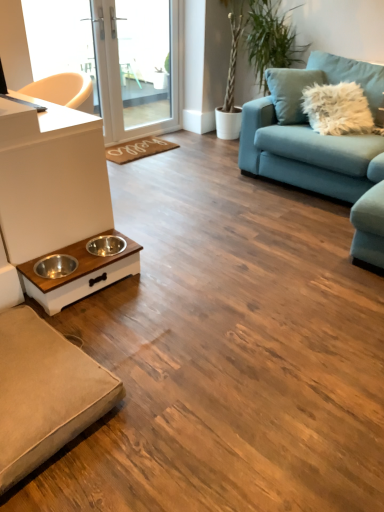
Image resolution: width=384 pixels, height=512 pixels. I want to click on free space that is in between white wood pet feeder at lower left and teal fabric couch at upper right, placed as the 2th studio couch when sorted from front to back, so click(x=221, y=231).